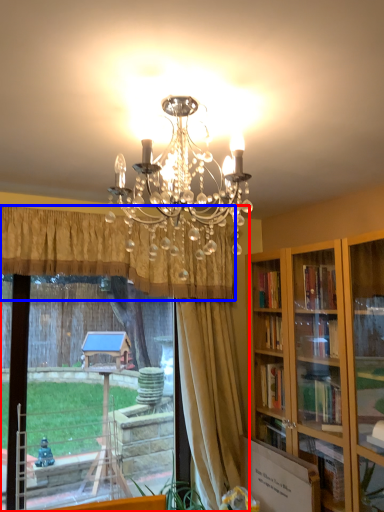
Question: Which point is further to the camera, window (highlighted by a red box) or curtain (highlighted by a blue box)?

Choices:
 (A) window
 (B) curtain

Answer: (A)